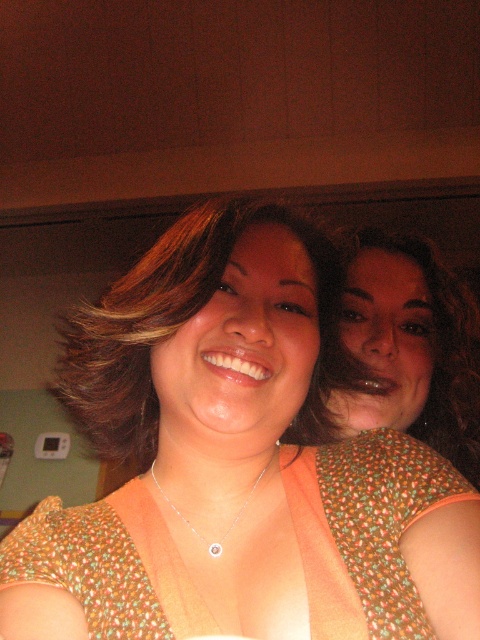
Question: Which is nearer to the printed fabric dress at center?

Choices:
 (A) matte brown hair at center
 (B) silver/gold chain with pendant at center
 (C) orange printed blouse at center

Answer: (C)

Question: Can you confirm if matte brown hair at center is thinner than silver/gold chain with pendant at center?

Choices:
 (A) no
 (B) yes

Answer: (A)

Question: Which of these objects is positioned closest to the orange printed blouse at center?

Choices:
 (A) silver/gold chain with pendant at center
 (B) printed fabric dress at center
 (C) matte brown hair at center

Answer: (B)

Question: Which of the following is the closest to the observer?

Choices:
 (A) orange printed blouse at center
 (B) silver/gold chain with pendant at center

Answer: (A)

Question: Is orange printed blouse at center below silver/gold chain with pendant at center?

Choices:
 (A) no
 (B) yes

Answer: (A)

Question: Considering the relative positions of matte brown hair at center and silver/gold chain with pendant at center in the image provided, where is matte brown hair at center located with respect to silver/gold chain with pendant at center?

Choices:
 (A) right
 (B) left

Answer: (B)